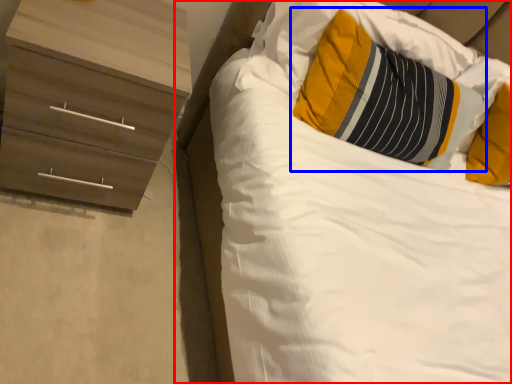
Question: Which of the following is the farthest to the observer, bed (highlighted by a red box) or pillow (highlighted by a blue box)?

Choices:
 (A) bed
 (B) pillow

Answer: (B)